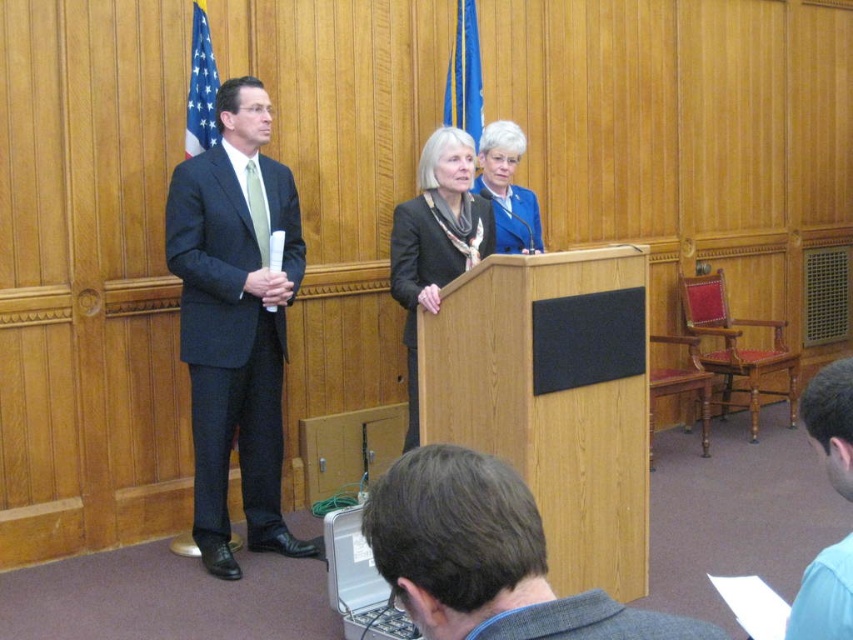
Who is lower down, gray suit at lower center or blue fabric jacket at center?

gray suit at lower center is below.

Who is taller, gray suit at lower center or blue fabric jacket at center?

Standing taller between the two is blue fabric jacket at center.

Is point (431, 538) less distant than point (514, 184)?

Yes, point (431, 538) is closer to viewer.

I want to click on gray suit at lower center, so click(486, 557).

Between point (258, 100) and point (809, 604), which one is positioned behind?

The point (258, 100) is more distant.

Is dark gray suit at left shorter than blue shirt at lower right?

No, dark gray suit at left is not shorter than blue shirt at lower right.

Between point (204, 564) and point (830, 458), which one is positioned behind?

Positioned behind is point (204, 564).

Find the location of `dark gray suit at left`. dark gray suit at left is located at coordinates (235, 321).

You are a GUI agent. You are given a task and a screenshot of the screen. Output one action in this format:
    pyautogui.click(x=<x>, y=<y>)
    Task: Click on the matte black jacket at center
    Image resolution: width=853 pixels, height=640 pixels.
    Given the screenshot: What is the action you would take?
    [x=434, y=241]

Does point (392, 280) lie in front of point (804, 625)?

No.

The height and width of the screenshot is (640, 853). Identify the location of matte black jacket at center. (434, 241).